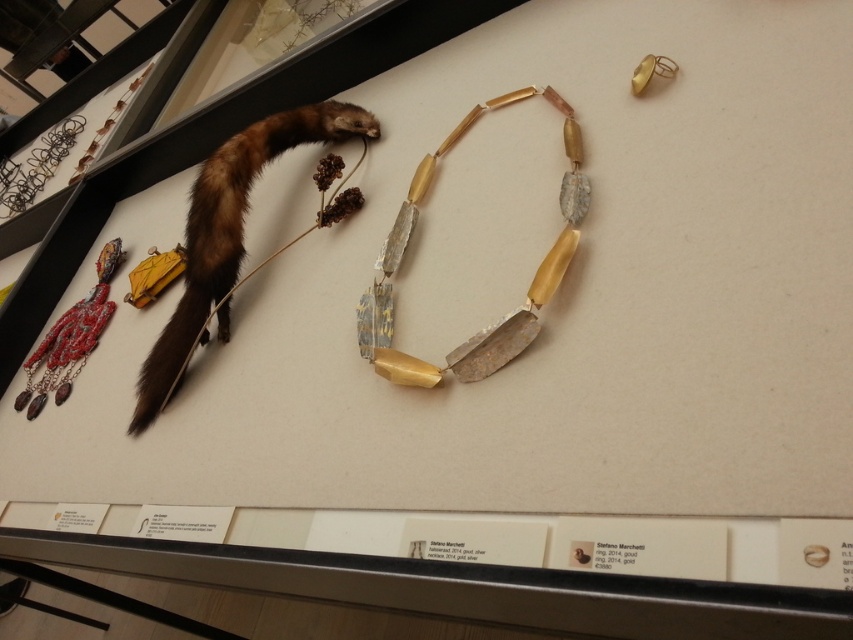
Does brown fur animal at upper left appear on the right side of reddish-brown leather necklace at lower left?

Indeed, brown fur animal at upper left is positioned on the right side of reddish-brown leather necklace at lower left.

Between point (171, 317) and point (73, 362), which one is positioned in front?

Positioned in front is point (171, 317).

Is point (186, 320) positioned in front of point (99, 269)?

Yes, it is in front of point (99, 269).

Find the location of `brown fur animal at upper left`. brown fur animal at upper left is located at coordinates (229, 236).

Can you confirm if brown fur animal at upper left is positioned to the left of gold textured necklace at center?

Indeed, brown fur animal at upper left is positioned on the left side of gold textured necklace at center.

Can you confirm if brown fur animal at upper left is smaller than gold textured necklace at center?

No.

The height and width of the screenshot is (640, 853). What do you see at coordinates (229, 236) in the screenshot? I see `brown fur animal at upper left` at bounding box center [229, 236].

Find the location of a particular element. This screenshot has width=853, height=640. brown fur animal at upper left is located at coordinates (229, 236).

Between gold textured necklace at center and reddish-brown leather necklace at lower left, which one is positioned lower?

reddish-brown leather necklace at lower left

Between gold textured necklace at center and reddish-brown leather necklace at lower left, which one has more height?

gold textured necklace at center

This screenshot has width=853, height=640. What do you see at coordinates (503, 316) in the screenshot? I see `gold textured necklace at center` at bounding box center [503, 316].

Identify the location of gold textured necklace at center. Image resolution: width=853 pixels, height=640 pixels. [503, 316].